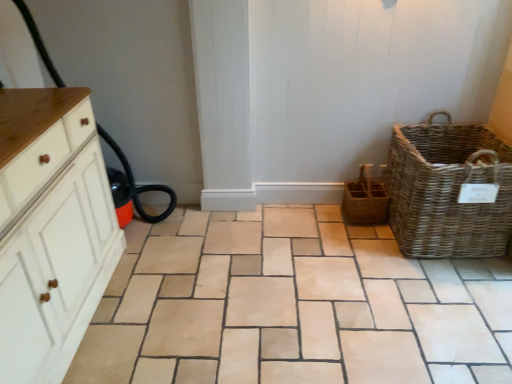
Find the location of a particular element. This screenshot has width=512, height=384. free area in between natural woven picnic basket at right and brown woven basket at center-right is located at coordinates (374, 240).